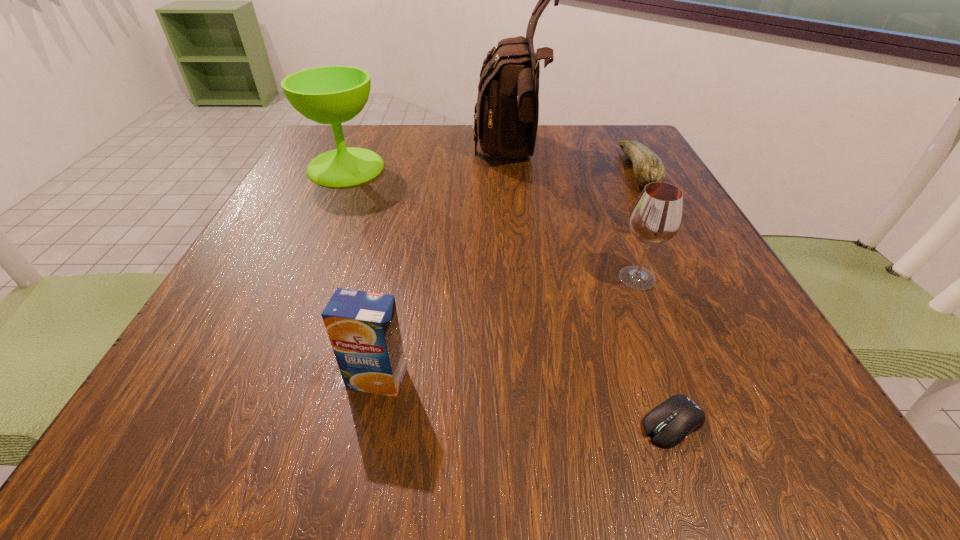
The width and height of the screenshot is (960, 540). Identify the location of the shortest object. (669, 423).

At what (x,y) coordinates should I click in order to perform the action: click on computer equipment. Please return your answer as a coordinate pair (x, y). This screenshot has height=540, width=960. Looking at the image, I should click on (669, 423).

This screenshot has height=540, width=960. I want to click on vacant region located on the front-facing side of the tallest object, so click(x=439, y=157).

Image resolution: width=960 pixels, height=540 pixels. Identify the location of vacant space located 0.240m on the front-facing side of the tallest object. (370, 157).

Identify the location of vacant space located 0.290m on the front-facing side of the tallest object. (348, 157).

You are a GUI agent. You are given a task and a screenshot of the screen. Output one action in this format:
    pyautogui.click(x=<x>, y=<y>)
    Task: Click on the vacant space positioned 0.130m on the back of the taller wineglass
    
    Given the screenshot: What is the action you would take?
    pyautogui.click(x=364, y=127)

You are a GUI agent. You are given a task and a screenshot of the screen. Output one action in this format:
    pyautogui.click(x=<x>, y=<y>)
    Task: Click on the vacant space located on the left of the third nearest object
    The width and height of the screenshot is (960, 540).
    Given the screenshot: What is the action you would take?
    click(x=527, y=278)

Where is `vacant space positioned 0.060m on the left of the orange_juice`? vacant space positioned 0.060m on the left of the orange_juice is located at coordinates (301, 379).

The height and width of the screenshot is (540, 960). I want to click on free space located 0.170m at the stem end of the rightmost object, so click(x=547, y=171).

Identify the location of free space located at the stem end of the rightmost object. Image resolution: width=960 pixels, height=540 pixels. (569, 171).